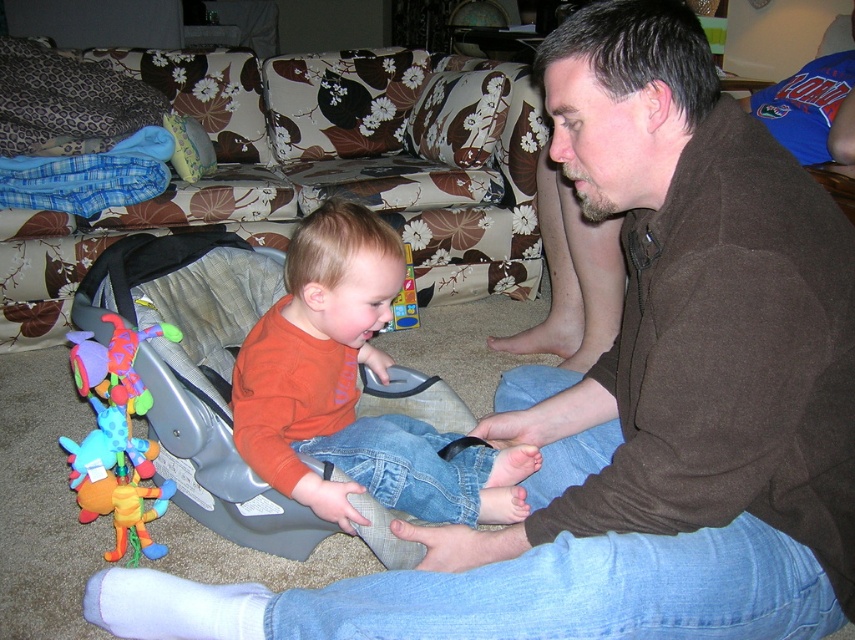
Question: Which point appears farthest from the camera in this image?

Choices:
 (A) (111, 384)
 (B) (274, 392)

Answer: (A)

Question: Which point is closer to the camera taking this photo?

Choices:
 (A) (101, 513)
 (B) (315, 401)

Answer: (B)

Question: Is orange soft shirt at center further to the viewer compared to plush multicolored baby rattle at left?

Choices:
 (A) no
 (B) yes

Answer: (A)

Question: Does orange soft shirt at center have a lesser width compared to plush multicolored baby rattle at left?

Choices:
 (A) no
 (B) yes

Answer: (A)

Question: Does orange soft shirt at center appear on the right side of plush multicolored baby rattle at left?

Choices:
 (A) no
 (B) yes

Answer: (B)